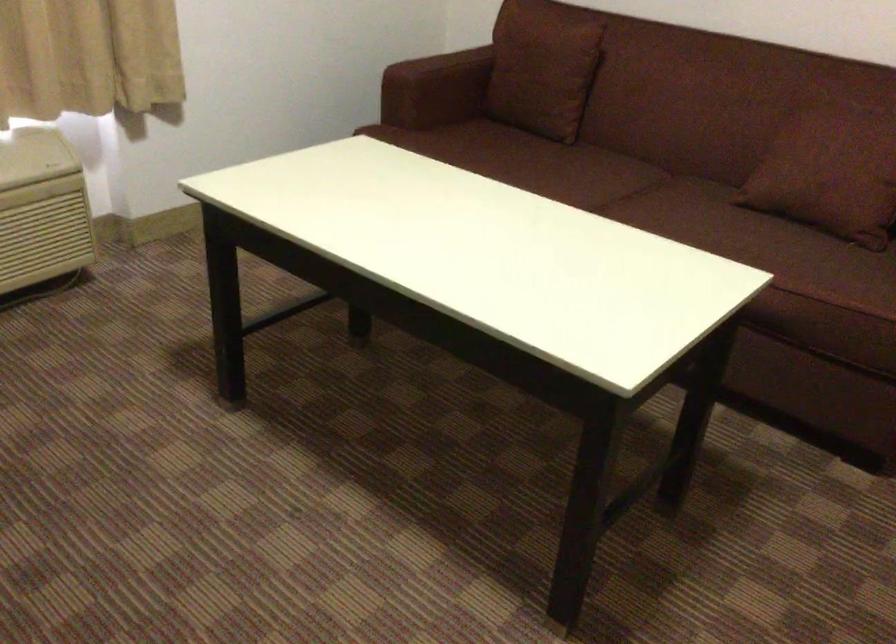
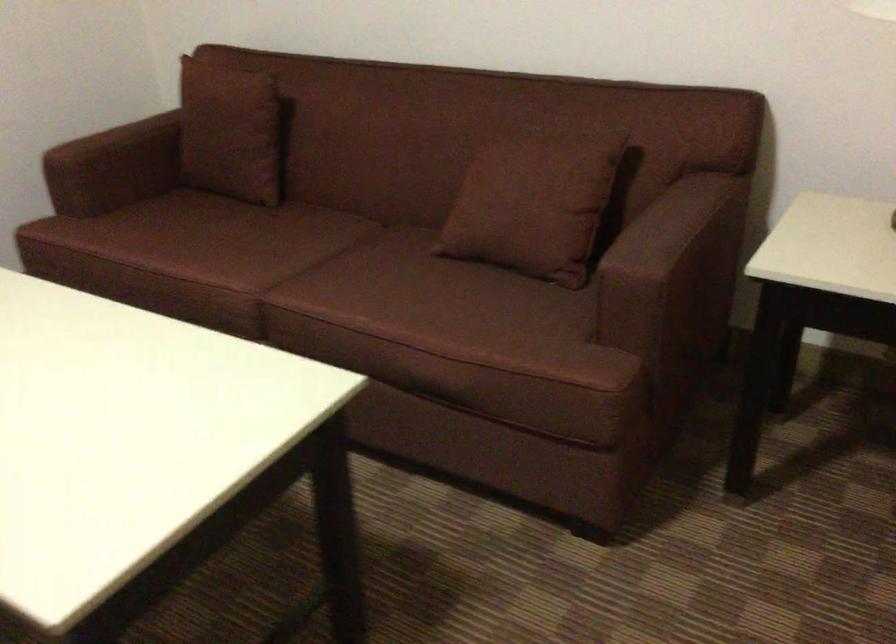
Question: How did the camera likely rotate?

Choices:
 (A) Left
 (B) Right
 (C) Up
 (D) Down

Answer: (B)